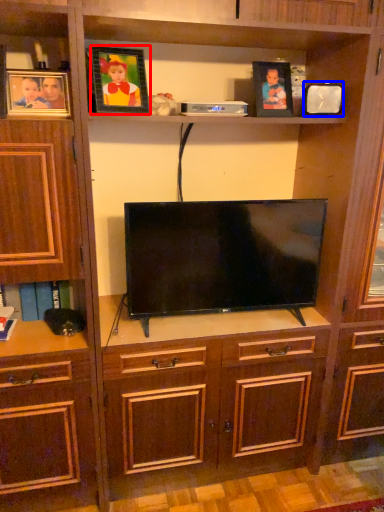
Question: Which object appears farthest to the camera in this image, picture frame (highlighted by a red box) or picture frame (highlighted by a blue box)?

Choices:
 (A) picture frame
 (B) picture frame

Answer: (B)